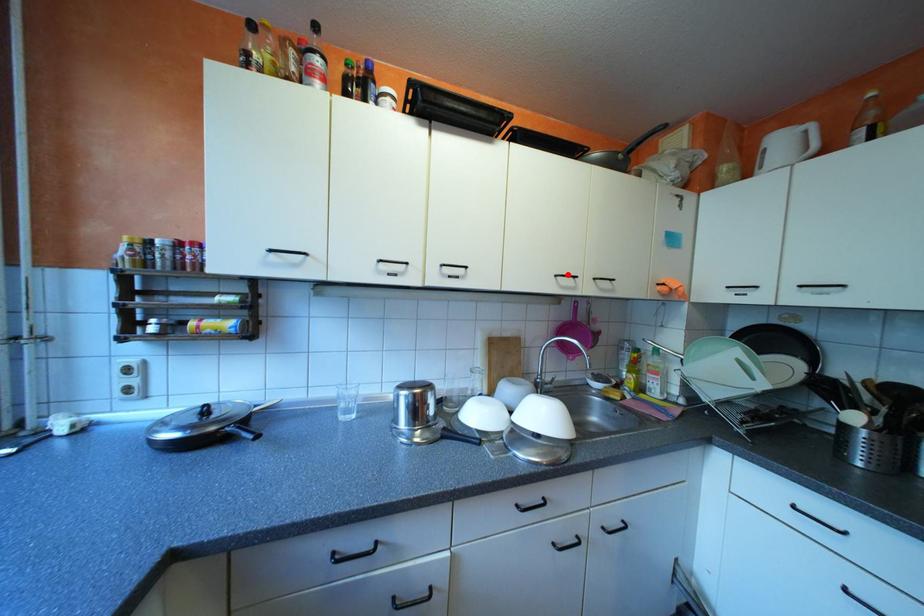
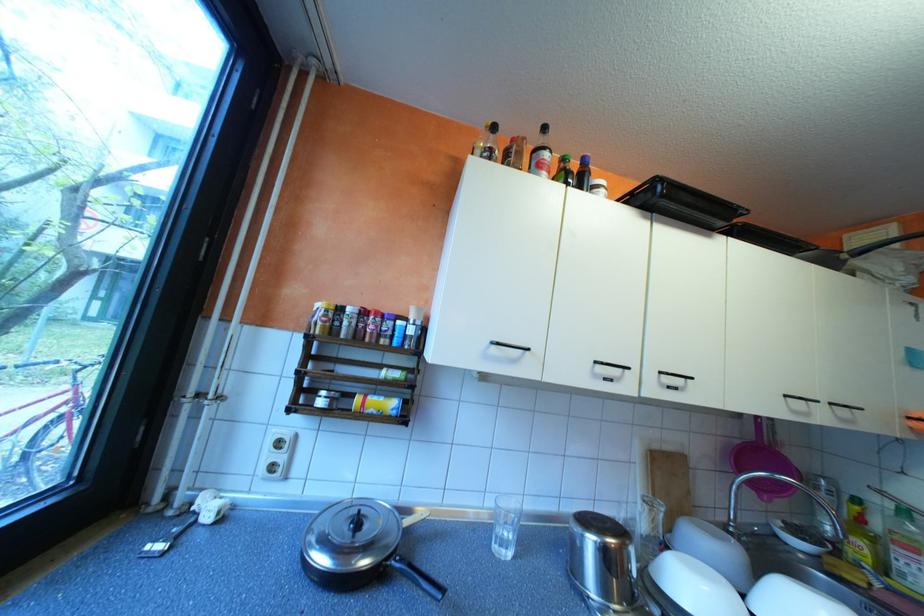
Locate, in the second image, the point that corresponds to the highlighted location in the first image.

(797, 395)